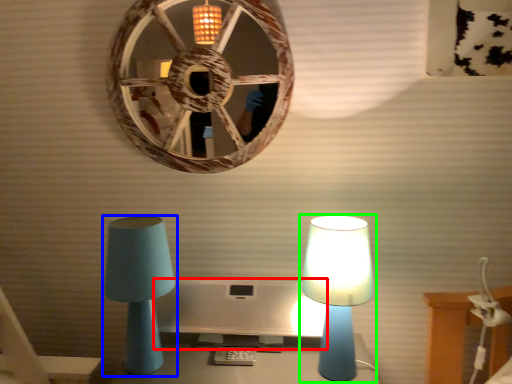
Question: Considering the real-world distances, which object is closest to computer monitor (highlighted by a red box)? lamp (highlighted by a blue box) or lamp (highlighted by a green box).

Choices:
 (A) lamp
 (B) lamp

Answer: (A)